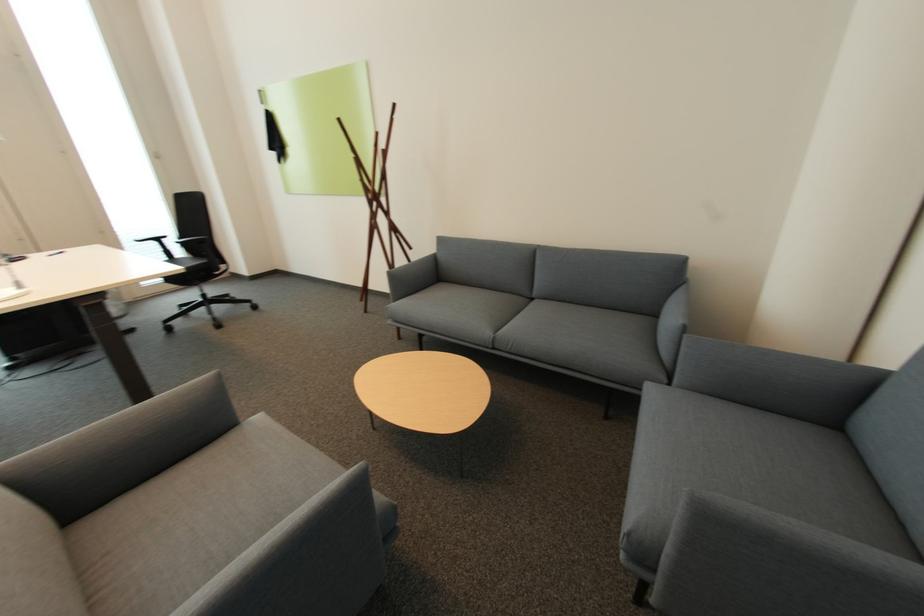
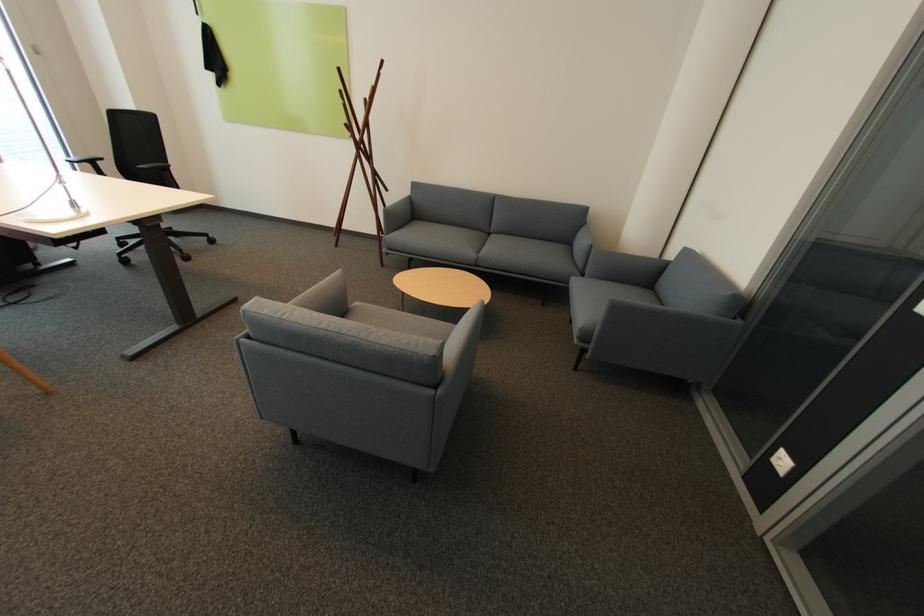
In the second image, find the point that corresponds to [501,349] in the first image.

(482, 265)